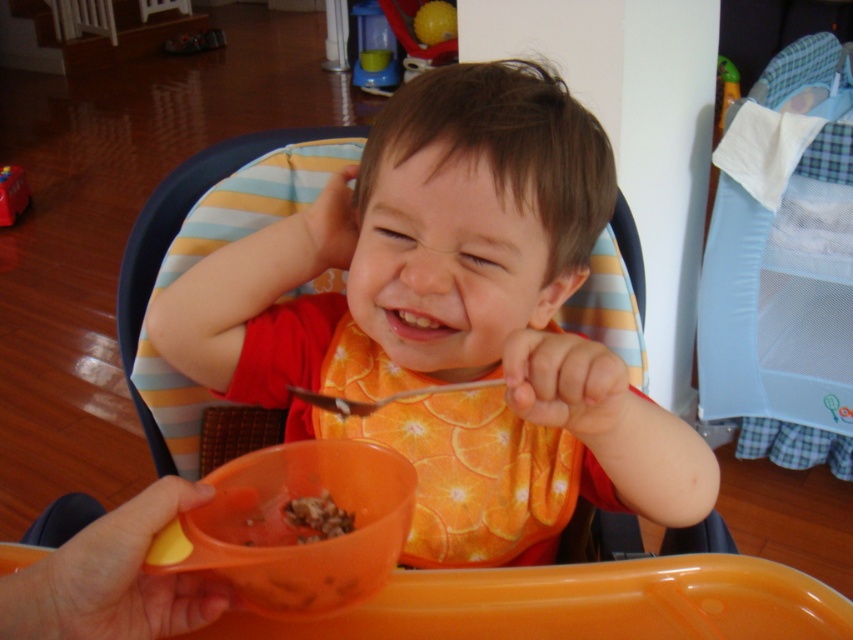
Does orange fabric bib at center have a greater height compared to metallic silver spoon at upper center?

Correct, orange fabric bib at center is much taller as metallic silver spoon at upper center.

Between point (575, 273) and point (459, 381), which one is positioned in front?

Positioned in front is point (459, 381).

At what (x,y) coordinates should I click in order to perform the action: click on orange fabric bib at center. Please return your answer as a coordinate pair (x, y). The height and width of the screenshot is (640, 853). Looking at the image, I should click on (451, 298).

Which is behind, point (305, 560) or point (312, 540)?

Positioned behind is point (312, 540).

Measure the distance between point (215,572) and camera.

Point (215,572) and camera are 19.51 inches apart.

This screenshot has width=853, height=640. I want to click on orange plastic bowl at lower center, so (296, 525).

Does orange plastic bowl at lower center appear under metallic silver spoon at upper center?

Yes, orange plastic bowl at lower center is below metallic silver spoon at upper center.

This screenshot has height=640, width=853. Describe the element at coordinates (296, 525) in the screenshot. I see `orange plastic bowl at lower center` at that location.

This screenshot has height=640, width=853. I want to click on orange plastic bowl at lower center, so [x=296, y=525].